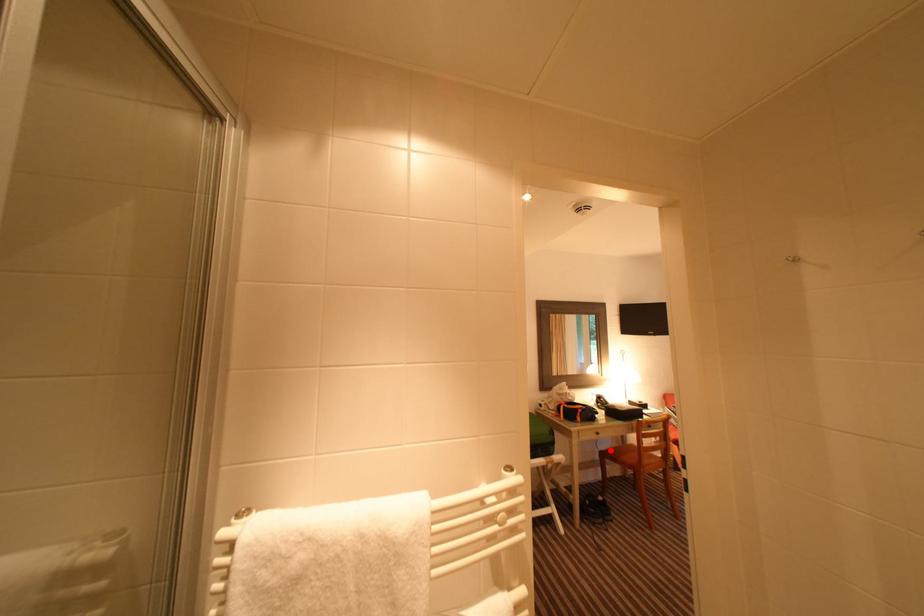
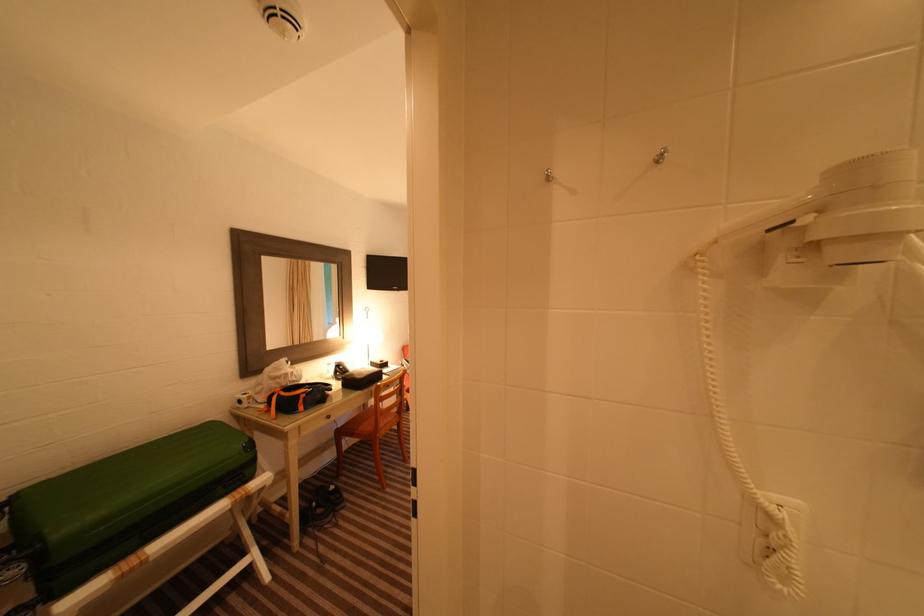
The point at the highlighted location is marked in the first image. Where is the corresponding point in the second image?

(347, 426)